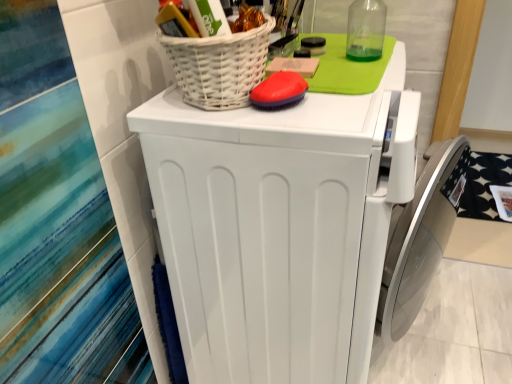
Question: From a real-world perspective, is red rubber brush at upper center under white wicker basket at upper center?

Choices:
 (A) yes
 (B) no

Answer: (A)

Question: Does red rubber brush at upper center appear on the left side of white wicker basket at upper center?

Choices:
 (A) no
 (B) yes

Answer: (A)

Question: From a real-world perspective, is red rubber brush at upper center over white wicker basket at upper center?

Choices:
 (A) yes
 (B) no

Answer: (B)

Question: From the image's perspective, is red rubber brush at upper center below white wicker basket at upper center?

Choices:
 (A) no
 (B) yes

Answer: (B)

Question: From the image's perspective, is red rubber brush at upper center on white wicker basket at upper center?

Choices:
 (A) yes
 (B) no

Answer: (B)

Question: Is red rubber brush at upper center smaller than white wicker basket at upper center?

Choices:
 (A) no
 (B) yes

Answer: (B)

Question: Is white wicker basket at upper center shorter than white matte washing machine at center?

Choices:
 (A) yes
 (B) no

Answer: (A)

Question: From the image's perspective, would you say white wicker basket at upper center is shown under white matte washing machine at center?

Choices:
 (A) yes
 (B) no

Answer: (B)

Question: Does white wicker basket at upper center have a larger size compared to white matte washing machine at center?

Choices:
 (A) yes
 (B) no

Answer: (B)

Question: Does white wicker basket at upper center have a smaller size compared to white matte washing machine at center?

Choices:
 (A) yes
 (B) no

Answer: (A)

Question: From the image's perspective, is white wicker basket at upper center on white matte washing machine at center?

Choices:
 (A) no
 (B) yes

Answer: (B)

Question: From a real-world perspective, is white wicker basket at upper center located higher than white matte washing machine at center?

Choices:
 (A) no
 (B) yes

Answer: (B)

Question: Considering the relative sizes of white wicker basket at upper center and red rubber brush at upper center in the image provided, is white wicker basket at upper center shorter than red rubber brush at upper center?

Choices:
 (A) no
 (B) yes

Answer: (A)